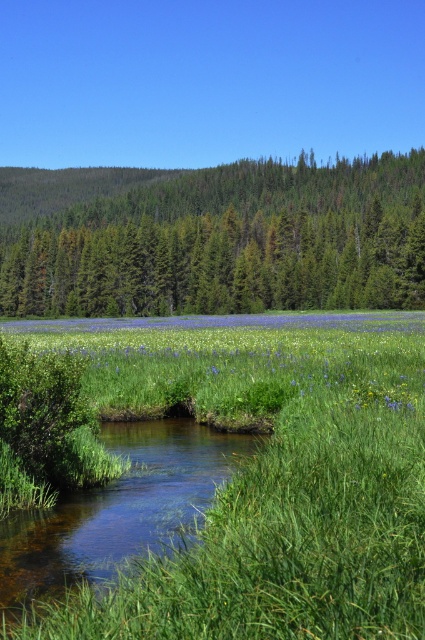
Question: Can you confirm if green textured trees at upper center is positioned above blue matte flower at center?

Choices:
 (A) no
 (B) yes

Answer: (B)

Question: Which point is closer to the camera?

Choices:
 (A) green textured trees at upper center
 (B) green grassy at center
 (C) clear water stream at center

Answer: (B)

Question: Which of the following is the farthest from the observer?

Choices:
 (A) green grassy at center
 (B) clear water stream at center

Answer: (B)

Question: Can you confirm if green textured trees at upper center is positioned to the right of clear water stream at center?

Choices:
 (A) yes
 (B) no

Answer: (B)

Question: Which point is closer to the camera?

Choices:
 (A) green textured trees at upper center
 (B) green grassy at center

Answer: (B)

Question: Does green grassy at center have a lesser width compared to green textured trees at upper center?

Choices:
 (A) no
 (B) yes

Answer: (B)